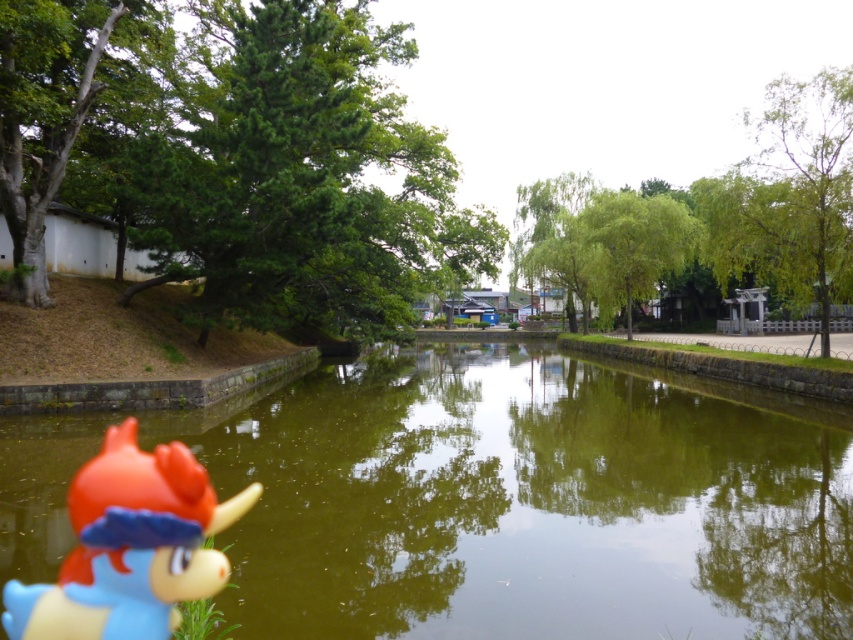
You are standing at the point labeled as point (80,596) and want to walk towards the point labeled as point (755,557). Given that there is a small boat exactly halfway between these two points, will the boat be in your direct path?

Yes, the boat will be in your direct path because the halfway point between point (80,596) and point (755,557) lies along the straight line connecting them, so the boat is directly in the path.

You are a small toy boat that is 10 cm long. You want to sail from the rubber duck at lower left to the green reflective water at center. Is there enough space for you to pass through the area between them?

The green reflective water at center might be wider than rubber duck at lower left, so there is likely enough space for the toy boat to pass through the area between them.

You are standing on a dock and see the green reflective water at center and the rubber duck at lower left. If you want to throw a pebble to create a ripple that reaches both objects, which object should you aim closer to in order to have the ripple reach both?

Since the green reflective water at center and rubber duck at lower left are 7.49 meters apart, you should aim the pebble between them so that the ripple can reach both objects.